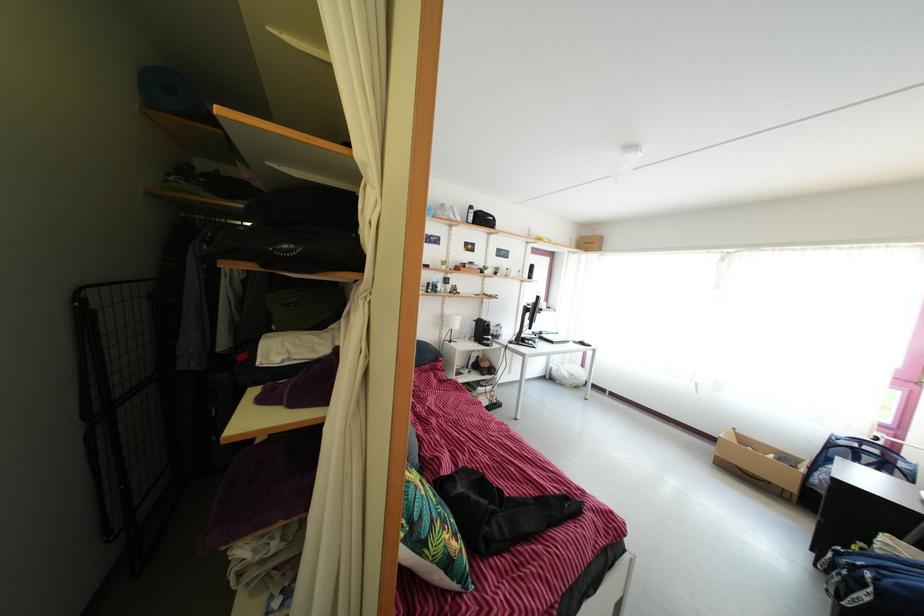
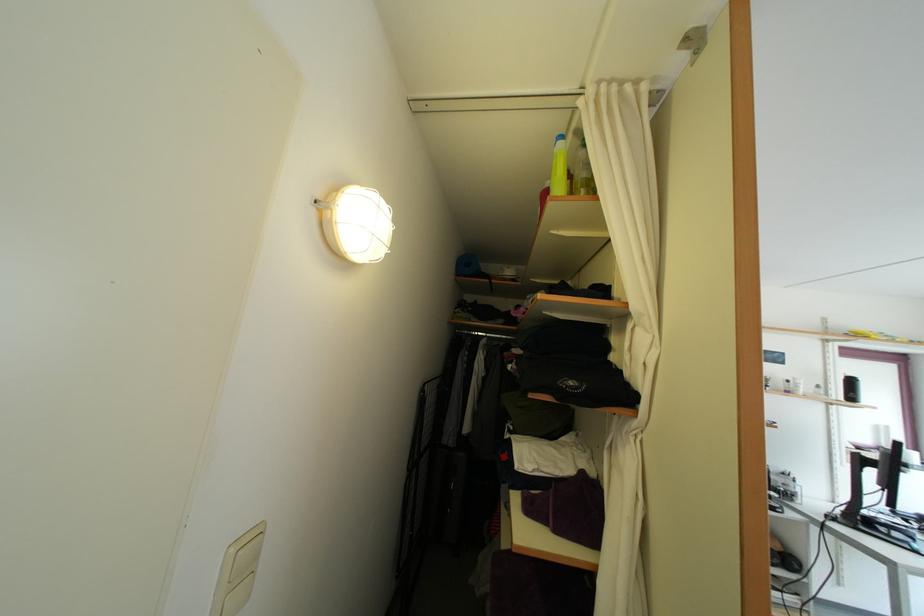
Find the pixel in the second image that matches (535,323) in the first image.

(878, 480)